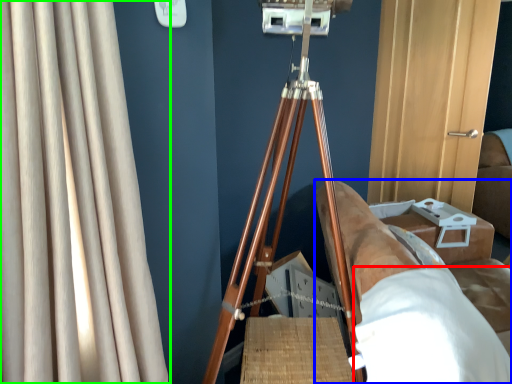
Question: Considering the real-world distances, which object is farthest from sheet (highlighted by a red box)? furniture (highlighted by a blue box) or curtain (highlighted by a green box)?

Choices:
 (A) furniture
 (B) curtain

Answer: (B)